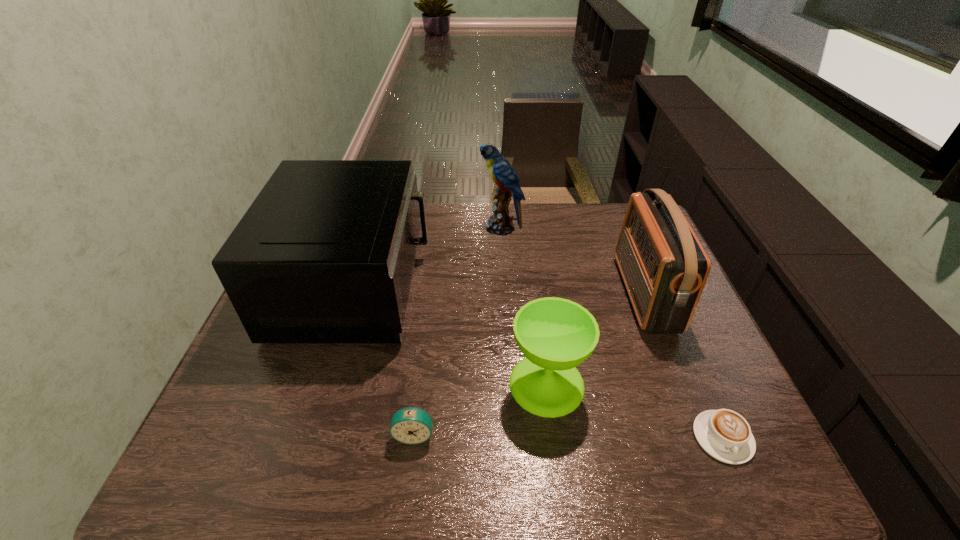
Identify the location of the farthest object. The image size is (960, 540). (501, 171).

The width and height of the screenshot is (960, 540). What are the coordinates of `radio receiver` in the screenshot? It's located at (664, 267).

Where is `microwave_oven`? This screenshot has width=960, height=540. microwave_oven is located at coordinates (325, 254).

At what (x,y) coordinates should I click in order to perform the action: click on wineglass. Please return your answer as a coordinate pair (x, y). Looking at the image, I should click on (555, 335).

What are the coordinates of `alarm clock` in the screenshot? It's located at (410, 425).

Find the location of a particular element. cappuccino is located at coordinates (725, 435).

Identify the location of free space located 0.120m on the face of the farthest object. The image size is (960, 540). (444, 227).

The height and width of the screenshot is (540, 960). I want to click on free location located 0.070m on the face of the farthest object, so click(x=459, y=227).

Find the location of a particular element. Image resolution: width=960 pixels, height=540 pixels. free space located on the face of the farthest object is located at coordinates (444, 227).

Locate an element on the screen. The image size is (960, 540). vacant space located on the front-facing side of the radio receiver is located at coordinates (499, 294).